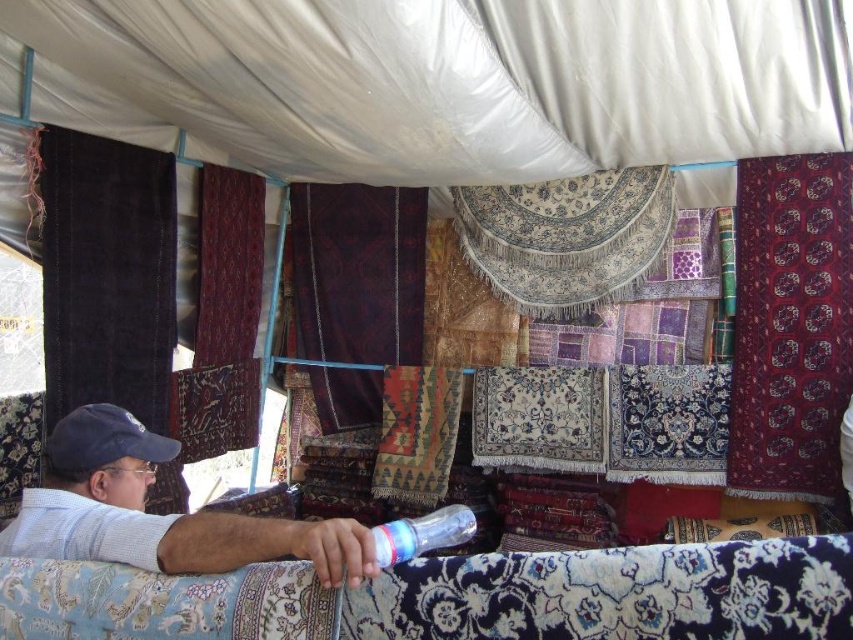
Question: Which point appears farthest from the camera in this image?

Choices:
 (A) [x=13, y=548]
 (B) [x=74, y=403]
 (C) [x=809, y=460]
 (D) [x=233, y=310]

Answer: (D)

Question: Does white cotton shirt at center have a lesser width compared to dark red woven rug at center?

Choices:
 (A) yes
 (B) no

Answer: (B)

Question: Which object appears closest to the camera in this image?

Choices:
 (A) black velvet rug at left
 (B) white cotton shirt at center

Answer: (B)

Question: Which point is closer to the camera?

Choices:
 (A) white cotton shirt at center
 (B) black velvet rug at left

Answer: (A)

Question: Considering the relative positions of dark velvet rug at center and blue fabric baseball cap at lower left in the image provided, where is dark velvet rug at center located with respect to blue fabric baseball cap at lower left?

Choices:
 (A) right
 (B) left

Answer: (A)

Question: Does dark red woven rug at upper right have a greater width compared to blue fabric baseball cap at lower left?

Choices:
 (A) yes
 (B) no

Answer: (A)